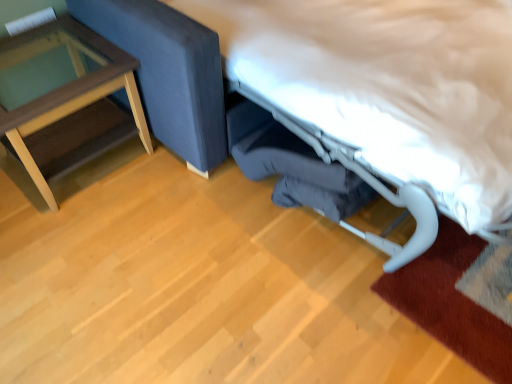
Question: Should I look upward or downward to see white fabric bed at center?

Choices:
 (A) up
 (B) down

Answer: (A)

Question: From the image's perspective, would you say white fabric bed at center is positioned over transparent glass table at left?

Choices:
 (A) yes
 (B) no

Answer: (A)

Question: Is transparent glass table at left completely or partially inside white fabric bed at center?

Choices:
 (A) yes
 (B) no

Answer: (B)

Question: Is white fabric bed at center outside of transparent glass table at left?

Choices:
 (A) yes
 (B) no

Answer: (A)

Question: Is white fabric bed at center far away from transparent glass table at left?

Choices:
 (A) no
 (B) yes

Answer: (A)

Question: Considering the relative sizes of white fabric bed at center and transparent glass table at left in the image provided, is white fabric bed at center bigger than transparent glass table at left?

Choices:
 (A) no
 (B) yes

Answer: (B)

Question: Is white fabric bed at center in contact with transparent glass table at left?

Choices:
 (A) yes
 (B) no

Answer: (B)

Question: Can you confirm if transparent glass table at left is positioned to the right of white fabric bed at center?

Choices:
 (A) no
 (B) yes

Answer: (A)

Question: Does transparent glass table at left have a lesser height compared to white fabric bed at center?

Choices:
 (A) no
 (B) yes

Answer: (B)

Question: Does transparent glass table at left appear on the left side of white fabric bed at center?

Choices:
 (A) no
 (B) yes

Answer: (B)

Question: Can we say transparent glass table at left lies outside white fabric bed at center?

Choices:
 (A) no
 (B) yes

Answer: (B)

Question: From a real-world perspective, is transparent glass table at left positioned over white fabric bed at center based on gravity?

Choices:
 (A) no
 (B) yes

Answer: (A)

Question: Considering the relative sizes of transparent glass table at left and white fabric bed at center in the image provided, is transparent glass table at left thinner than white fabric bed at center?

Choices:
 (A) yes
 (B) no

Answer: (A)

Question: Considering the positions of transparent glass table at left and white fabric bed at center in the image, is transparent glass table at left wider or thinner than white fabric bed at center?

Choices:
 (A) wide
 (B) thin

Answer: (B)